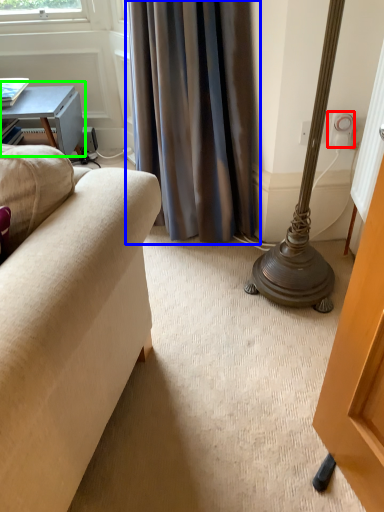
Question: Which object is positioned farthest from electric outlet (highlighted by a red box)? Select from curtain (highlighted by a blue box) and table (highlighted by a green box).

Choices:
 (A) curtain
 (B) table

Answer: (B)